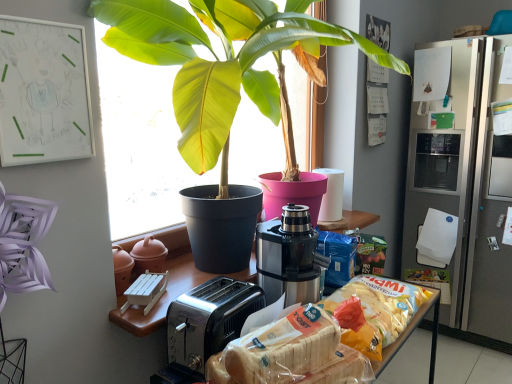
The image size is (512, 384). Identify the location of satin silver refrigerator at right. (463, 190).

The image size is (512, 384). What are the coordinates of `green glossy leafy plant at center` in the screenshot? It's located at (227, 62).

Find the location of a particular element. The image size is (512, 384). white plastic bread at lower center, arranged as the first snack when viewed from the front is located at coordinates (291, 354).

Identify the location of translucent plastic bag of chips at center, the second snack when ordered from front to back. The width and height of the screenshot is (512, 384). (374, 311).

Image resolution: width=512 pixels, height=384 pixels. I want to click on satin silver refrigerator at right, so click(463, 190).

Is translucent plastic bag of chips at center, the second snack when ordered from front to back, to the right of green glossy leafy plant at center from the viewer's perspective?

Yes.

Considering the sizes of objects translucent plastic bag of chips at center, the second snack when ordered from front to back, and green glossy leafy plant at center in the image provided, who is shorter, translucent plastic bag of chips at center, the second snack when ordered from front to back, or green glossy leafy plant at center?

With less height is translucent plastic bag of chips at center, the second snack when ordered from front to back.

Does translucent plastic bag of chips at center, which is the first snack in back-to-front order, come in front of green glossy leafy plant at center?

No, translucent plastic bag of chips at center, which is the first snack in back-to-front order, is further to the viewer.

Could you tell me if translucent plastic bag of chips at center, the second snack when ordered from front to back, is turned towards green glossy leafy plant at center?

No.

Who is shorter, white plastic bread at lower center, arranged as the first snack when viewed from the front, or satin silver refrigerator at right?

white plastic bread at lower center, arranged as the first snack when viewed from the front.

Is white plastic bread at lower center, arranged as the first snack when viewed from the front, positioned beyond the bounds of satin silver refrigerator at right?

Yes.

Considering the positions of objects white plastic bread at lower center, the 2th snack positioned from the back, and satin silver refrigerator at right in the image provided, who is more to the right, white plastic bread at lower center, the 2th snack positioned from the back, or satin silver refrigerator at right?

satin silver refrigerator at right.

In terms of size, does satin silver refrigerator at right appear bigger or smaller than green glossy leafy plant at center?

In the image, satin silver refrigerator at right appears to be larger than green glossy leafy plant at center.

Does satin silver refrigerator at right have a greater height compared to green glossy leafy plant at center?

Correct, satin silver refrigerator at right is much taller as green glossy leafy plant at center.

This screenshot has width=512, height=384. In order to click on fridge below the green glossy leafy plant at center (from the image's perspective) in this screenshot , I will do `click(463, 190)`.

Does satin silver refrigerator at right turn towards green glossy leafy plant at center?

Yes, satin silver refrigerator at right is aimed at green glossy leafy plant at center.

Can you confirm if translucent plastic bag of chips at center, which is the first snack in back-to-front order, is wider than stainless steel coffee machine at center?

Incorrect, the width of translucent plastic bag of chips at center, which is the first snack in back-to-front order, does not surpass that of stainless steel coffee machine at center.

Considering the relative sizes of translucent plastic bag of chips at center, the second snack when ordered from front to back, and stainless steel coffee machine at center in the image provided, is translucent plastic bag of chips at center, the second snack when ordered from front to back, bigger than stainless steel coffee machine at center?

Incorrect, translucent plastic bag of chips at center, the second snack when ordered from front to back, is not larger than stainless steel coffee machine at center.

Is the position of translucent plastic bag of chips at center, which is the first snack in back-to-front order, more distant than that of stainless steel coffee machine at center?

No, the depth of translucent plastic bag of chips at center, which is the first snack in back-to-front order, is less than that of stainless steel coffee machine at center.

Where is `coffee machine above the translucent plastic bag of chips at center, the second snack when ordered from front to back (from the image's perspective)`? The width and height of the screenshot is (512, 384). coffee machine above the translucent plastic bag of chips at center, the second snack when ordered from front to back (from the image's perspective) is located at coordinates (289, 257).

From the image's perspective, count 1st snacks downward from the stainless steel coffee machine at center and point to it. Please provide its 2D coordinates.

[(291, 354)]

Is the position of white plastic bread at lower center, the 2th snack positioned from the back, less distant than that of stainless steel coffee machine at center?

Yes, white plastic bread at lower center, the 2th snack positioned from the back, is closer to the viewer.

Looking at their sizes, would you say white plastic bread at lower center, arranged as the first snack when viewed from the front, is wider or thinner than stainless steel coffee machine at center?

Considering their sizes, white plastic bread at lower center, arranged as the first snack when viewed from the front, looks slimmer than stainless steel coffee machine at center.

Can you confirm if white plastic bread at lower center, the 2th snack positioned from the back, is bigger than translucent plastic bag of chips at center, which is the first snack in back-to-front order?

Actually, white plastic bread at lower center, the 2th snack positioned from the back, might be smaller than translucent plastic bag of chips at center, which is the first snack in back-to-front order.

Does white plastic bread at lower center, the 2th snack positioned from the back, have a greater height compared to translucent plastic bag of chips at center, the second snack when ordered from front to back?

In fact, white plastic bread at lower center, the 2th snack positioned from the back, may be shorter than translucent plastic bag of chips at center, the second snack when ordered from front to back.

The height and width of the screenshot is (384, 512). In order to click on snack that is on the left side of translucent plastic bag of chips at center, the second snack when ordered from front to back in this screenshot , I will do `click(291, 354)`.

How different are the orientations of white plastic bread at lower center, arranged as the first snack when viewed from the front, and translucent plastic bag of chips at center, the second snack when ordered from front to back, in degrees?

The facing directions of white plastic bread at lower center, arranged as the first snack when viewed from the front, and translucent plastic bag of chips at center, the second snack when ordered from front to back, are 16.4 degrees apart.

Is stainless steel coffee machine at center facing away from satin silver refrigerator at right?

No, stainless steel coffee machine at center's orientation is not away from satin silver refrigerator at right.

Who is shorter, stainless steel coffee machine at center or satin silver refrigerator at right?

stainless steel coffee machine at center.

In the scene shown: Can you confirm if stainless steel coffee machine at center is bigger than satin silver refrigerator at right?

Actually, stainless steel coffee machine at center might be smaller than satin silver refrigerator at right.

From the image's perspective, would you say stainless steel coffee machine at center is shown under satin silver refrigerator at right?

Yes, from the image's perspective, stainless steel coffee machine at center is below satin silver refrigerator at right.

Identify the location of houseplant in front of the translucent plastic bag of chips at center, which is the first snack in back-to-front order. (227, 62).

From the image's perspective, which snack is the 1st one below the satin silver refrigerator at right? Please provide its 2D coordinates.

[(291, 354)]

In the scene shown: Which object lies nearer to the anchor point satin silver refrigerator at right, green glossy leafy plant at center or white plastic bread at lower center, arranged as the first snack when viewed from the front?

The object closer to satin silver refrigerator at right is green glossy leafy plant at center.

From the image, which object appears to be nearer to stainless steel coffee machine at center, translucent plastic bag of chips at center, the second snack when ordered from front to back, or satin silver refrigerator at right?

Among the two, translucent plastic bag of chips at center, the second snack when ordered from front to back, is located nearer to stainless steel coffee machine at center.

Estimate the real-world distances between objects in this image. Which object is further from translucent plastic bag of chips at center, which is the first snack in back-to-front order, stainless steel coffee machine at center or white plastic bread at lower center, arranged as the first snack when viewed from the front?

Among the two, white plastic bread at lower center, arranged as the first snack when viewed from the front, is located further to translucent plastic bag of chips at center, which is the first snack in back-to-front order.

Consider the image. When comparing their distances from white plastic bread at lower center, arranged as the first snack when viewed from the front, does satin silver refrigerator at right or translucent plastic bag of chips at center, which is the first snack in back-to-front order, seem closer?

The object closer to white plastic bread at lower center, arranged as the first snack when viewed from the front, is translucent plastic bag of chips at center, which is the first snack in back-to-front order.

Considering their positions, is translucent plastic bag of chips at center, the second snack when ordered from front to back, positioned closer to green glossy leafy plant at center than satin silver refrigerator at right?

translucent plastic bag of chips at center, the second snack when ordered from front to back, is positioned closer to the anchor green glossy leafy plant at center.

Estimate the real-world distances between objects in this image. Which object is closer to green glossy leafy plant at center, stainless steel coffee machine at center or satin silver refrigerator at right?

stainless steel coffee machine at center.

Estimate the real-world distances between objects in this image. Which object is further from translucent plastic bag of chips at center, the second snack when ordered from front to back, white plastic bread at lower center, the 2th snack positioned from the back, or satin silver refrigerator at right?

satin silver refrigerator at right is further to translucent plastic bag of chips at center, the second snack when ordered from front to back.

Which object lies further to the anchor point translucent plastic bag of chips at center, which is the first snack in back-to-front order, green glossy leafy plant at center or white plastic bread at lower center, the 2th snack positioned from the back?

Among the two, green glossy leafy plant at center is located further to translucent plastic bag of chips at center, which is the first snack in back-to-front order.

Find the location of `snack located between white plastic bread at lower center, the 2th snack positioned from the back, and stainless steel coffee machine at center in the depth direction`. snack located between white plastic bread at lower center, the 2th snack positioned from the back, and stainless steel coffee machine at center in the depth direction is located at coordinates (374, 311).

At what (x,y) coordinates should I click in order to perform the action: click on houseplant between white plastic bread at lower center, arranged as the first snack when viewed from the front, and satin silver refrigerator at right, in the horizontal direction. Please return your answer as a coordinate pair (x, y). Image resolution: width=512 pixels, height=384 pixels. Looking at the image, I should click on (227, 62).

Locate an element on the screen. The image size is (512, 384). houseplant located between stainless steel coffee machine at center and satin silver refrigerator at right in the left-right direction is located at coordinates (227, 62).

Locate an element on the screen. This screenshot has width=512, height=384. snack located between green glossy leafy plant at center and satin silver refrigerator at right in the left-right direction is located at coordinates (374, 311).